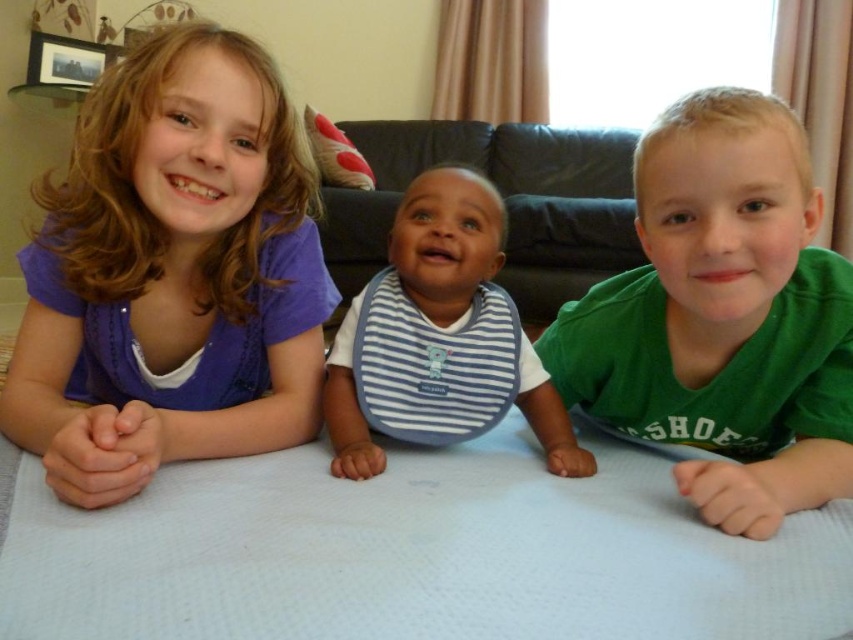
Looking at this image, which of these two, purple fabric shirt at left or black leather couch at center, stands taller?

Standing taller between the two is purple fabric shirt at left.

The height and width of the screenshot is (640, 853). Describe the element at coordinates (171, 275) in the screenshot. I see `purple fabric shirt at left` at that location.

Between point (201, 42) and point (477, 164), which one is positioned in front?

Point (201, 42)

Locate an element on the screen. The image size is (853, 640). purple fabric shirt at left is located at coordinates (171, 275).

Who is more distant from viewer, (83, 387) or (778, 342)?

The point (83, 387) is more distant.

Which is behind, point (258, 237) or point (693, 131)?

The point (258, 237) is more distant.

Where is `purple fabric shirt at left`? purple fabric shirt at left is located at coordinates coord(171,275).

Can you confirm if purple fabric shirt at left is shorter than blue striped bib at center?

No.

Does purple fabric shirt at left have a smaller size compared to blue striped bib at center?

Actually, purple fabric shirt at left might be larger than blue striped bib at center.

Does point (308, 268) lie behind point (540, 388)?

No, (308, 268) is in front of (540, 388).

Identify the location of purple fabric shirt at left. The image size is (853, 640). (171, 275).